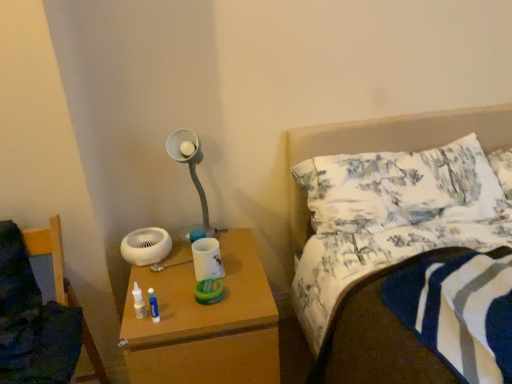
Question: From a real-world perspective, is wooden nightstand at lower center physically located above or below wooden chair at lower left?

Choices:
 (A) below
 (B) above

Answer: (A)

Question: Looking at their shapes, would you say wooden nightstand at lower center is wider or thinner than wooden chair at lower left?

Choices:
 (A) wide
 (B) thin

Answer: (A)

Question: Which of these objects is positioned closest to the wooden nightstand at lower center?

Choices:
 (A) white printed fabric pillow at upper right
 (B) white matte lamp at upper center
 (C) wooden chair at lower left

Answer: (C)

Question: Which is nearer to the wooden nightstand at lower center?

Choices:
 (A) wooden chair at lower left
 (B) white matte lamp at upper center
 (C) white printed fabric pillow at upper right

Answer: (A)